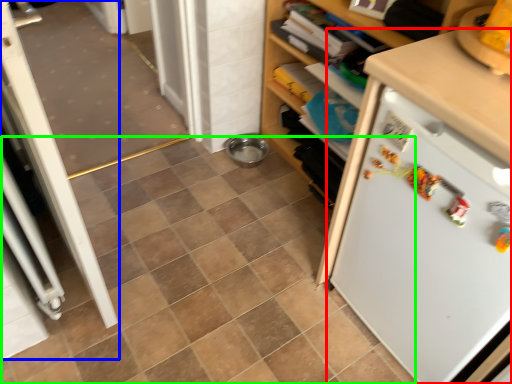
Question: Which object is the farthest from refrigerator (highlighted by a red box)? Choose among these: screen door (highlighted by a blue box) or ceramic tile (highlighted by a green box).

Choices:
 (A) screen door
 (B) ceramic tile

Answer: (A)